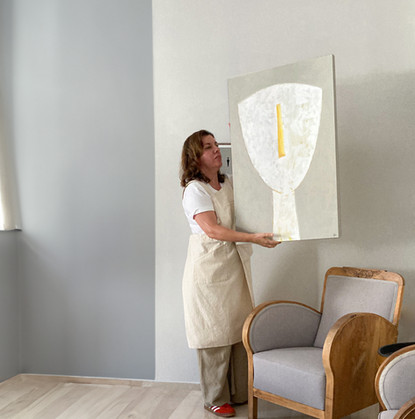
Locate an element on the screen. The height and width of the screenshot is (419, 415). piece of art is located at coordinates (298, 177).